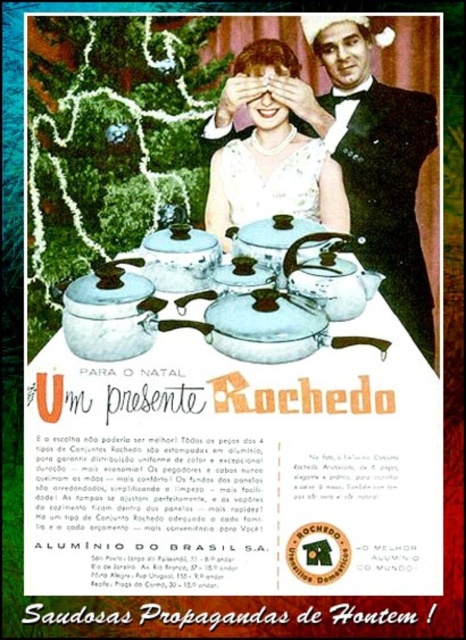
Between point (260, 147) and point (95, 275), which one is positioned behind?

Positioned behind is point (260, 147).

Is matte white dress at center in front of matte aluminum tea pot at center?

No, matte white dress at center is further to the viewer.

The image size is (466, 640). Describe the element at coordinates (271, 148) in the screenshot. I see `matte white dress at center` at that location.

Find the location of a particular element. matte white dress at center is located at coordinates pos(271,148).

Which of these two, black velvet suit at right or matte aluminum tea pot at center, stands taller?

black velvet suit at right

Does black velvet suit at right appear over matte aluminum tea pot at center?

Yes, black velvet suit at right is above matte aluminum tea pot at center.

Is point (351, 193) positioned behind point (129, 284)?

Yes.

The height and width of the screenshot is (640, 466). I want to click on black velvet suit at right, so click(x=381, y=164).

Does black velvet suit at right appear on the left side of white porcelain teapot at center?

In fact, black velvet suit at right is to the right of white porcelain teapot at center.

Does point (383, 92) come farther from viewer compared to point (316, 257)?

That is True.

Image resolution: width=466 pixels, height=640 pixels. What do you see at coordinates (381, 164) in the screenshot?
I see `black velvet suit at right` at bounding box center [381, 164].

Where is `black velvet suit at right`? This screenshot has width=466, height=640. black velvet suit at right is located at coordinates tap(381, 164).